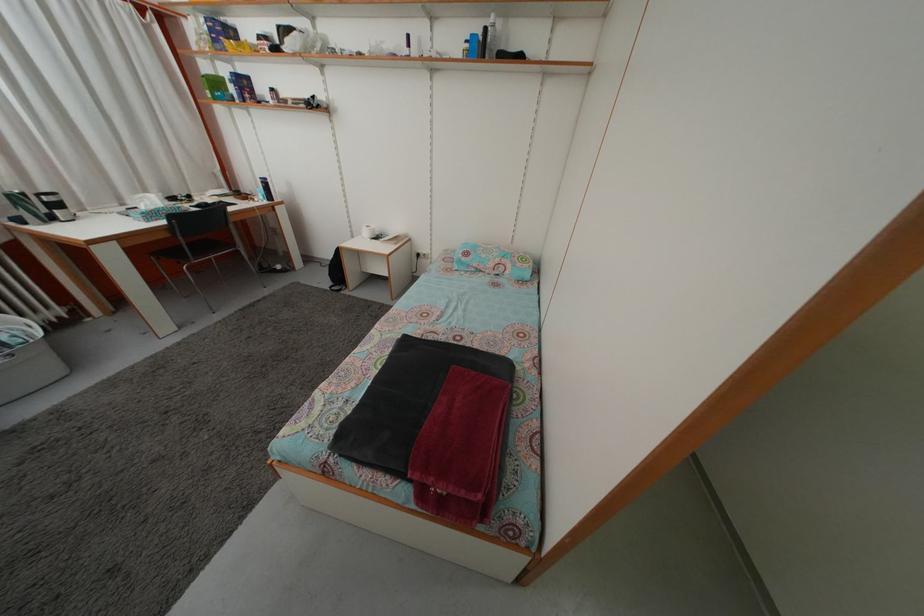
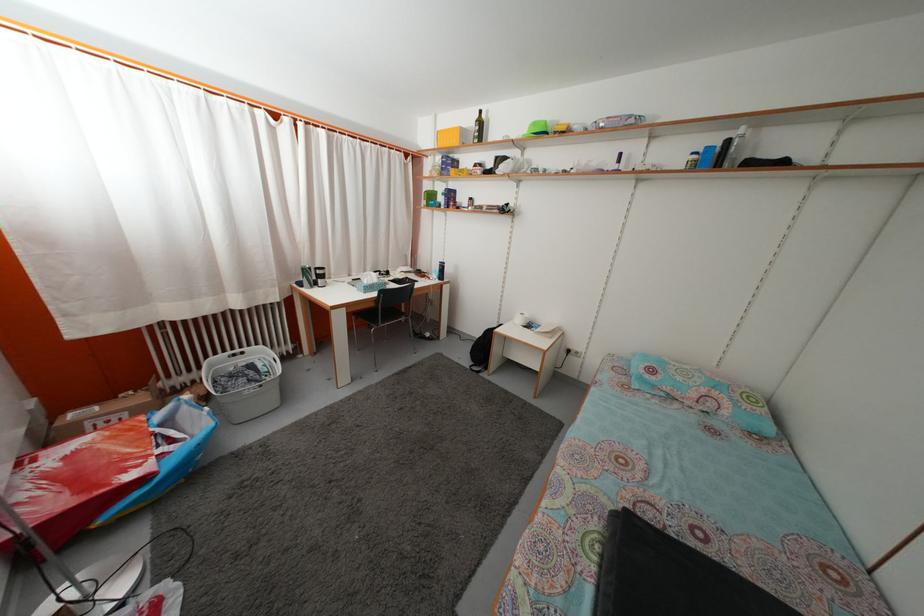
In the second image, find the point that corresponds to pixel 30 201 in the first image.

(315, 276)